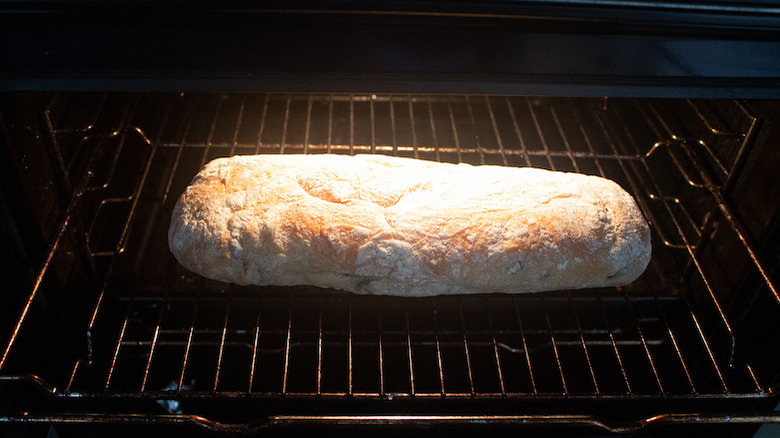
I want to click on light, so click(370, 95).